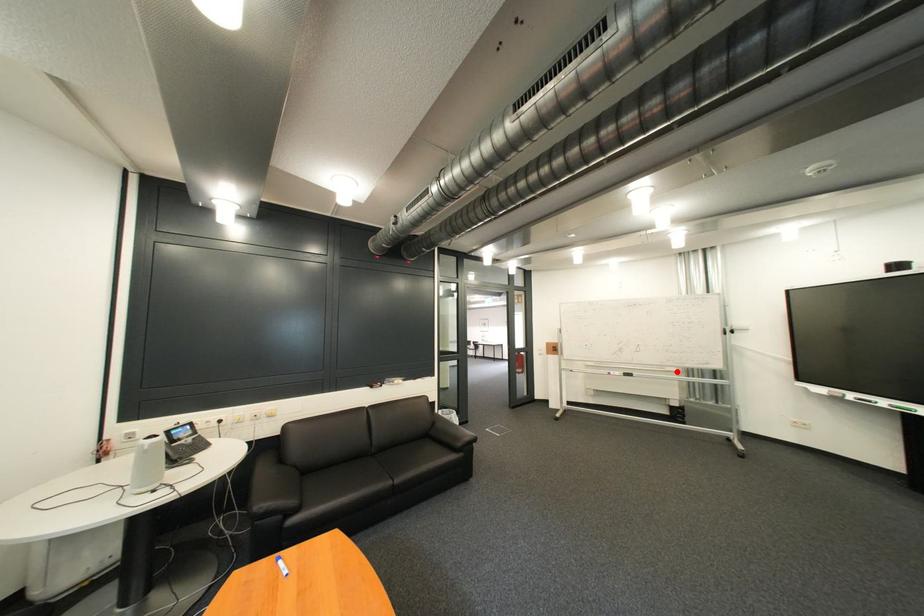
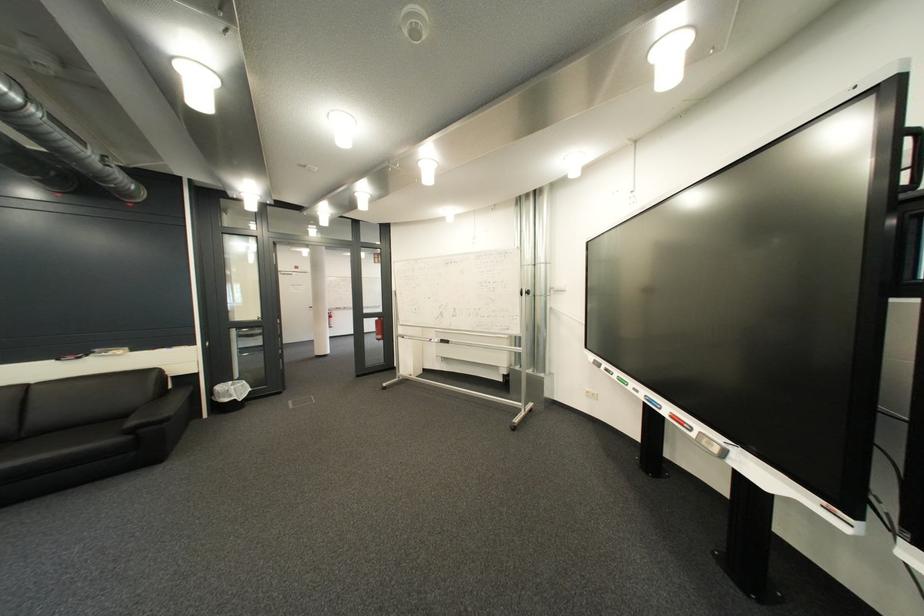
Question: I am providing you with two images of the same scene from different viewpoints. A red point is marked on the first image. Is the red point's position out of view in image 2?

Choices:
 (A) Yes
 (B) No

Answer: (B)